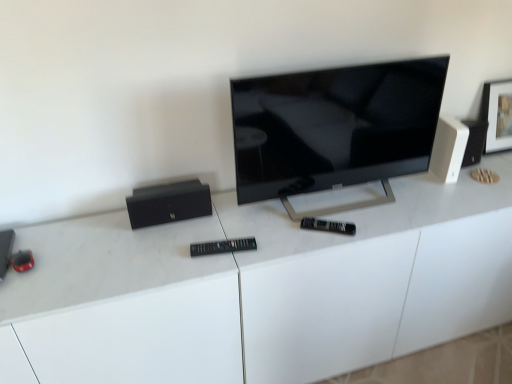
Identify the location of free space between black plastic remote at center and black glossy tv at center. (271, 235).